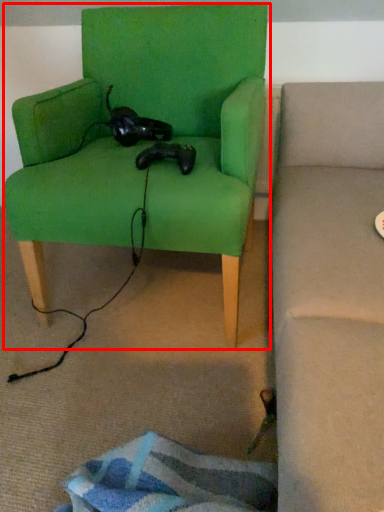
Question: In this image, where is chair (annotated by the red box) located relative to animal?

Choices:
 (A) left
 (B) right

Answer: (A)